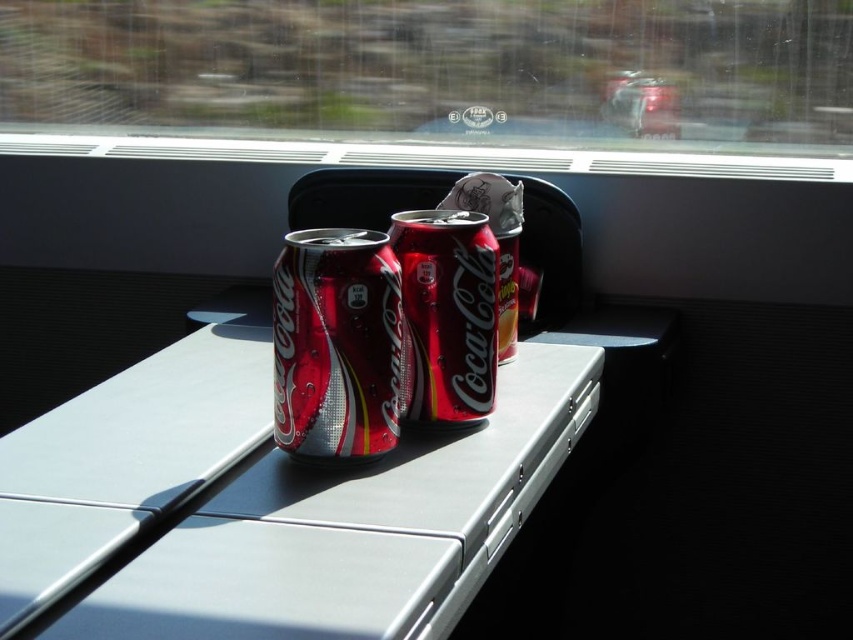
Does transparent glass train window at center appear over metallic silver window sill at center?

Correct, transparent glass train window at center is located above metallic silver window sill at center.

Is transparent glass train window at center positioned before metallic silver window sill at center?

No.

Between point (254, 33) and point (207, 147), which one is positioned in front?

Point (254, 33) is in front.

The image size is (853, 640). What are the coordinates of `transparent glass train window at center` in the screenshot? It's located at (440, 68).

How distant is metallic gray table at center from shiny metallic can at center?

metallic gray table at center is 6.77 inches from shiny metallic can at center.

This screenshot has height=640, width=853. What do you see at coordinates (268, 502) in the screenshot?
I see `metallic gray table at center` at bounding box center [268, 502].

Who is more forward, (461,538) or (305,340)?

Point (461,538) is more forward.

Find the location of a particular element. The width and height of the screenshot is (853, 640). metallic gray table at center is located at coordinates (268, 502).

Measure the distance between metallic gray table at center and camera.

A distance of 57.81 centimeters exists between metallic gray table at center and camera.

Who is positioned more to the left, metallic gray table at center or transparent glass train window at center?

Positioned to the left is metallic gray table at center.

Between point (287, 561) and point (283, 16), which one is positioned behind?

The point (283, 16) is more distant.

Identify the location of metallic gray table at center. (268, 502).